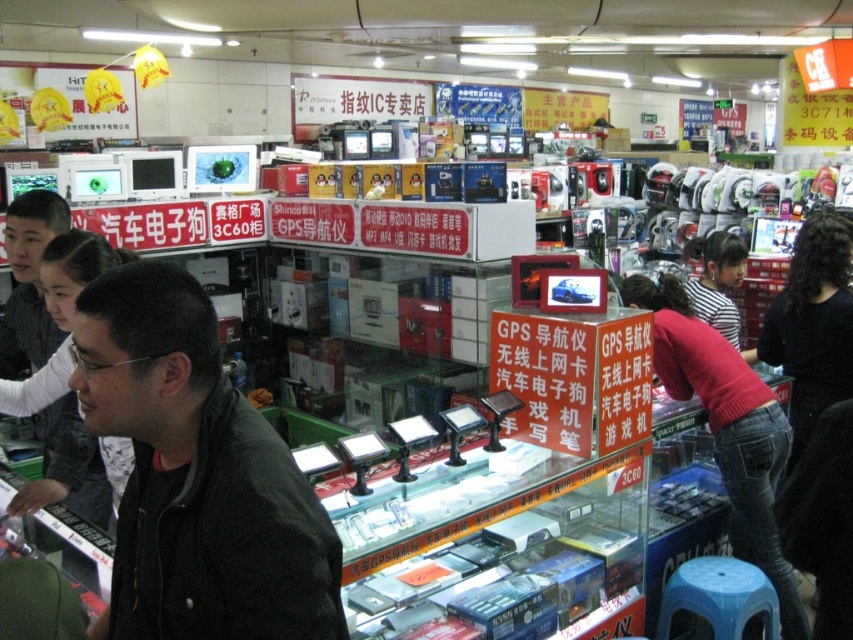
You are a customer in the electronics store looking for a black matte jacket. You see two black matte jackets displayed in the store. Which one is positioned lower between the black matte jacket at lower left and the black matte jacket at left?

The black matte jacket at lower left is positioned lower than the black matte jacket at left.